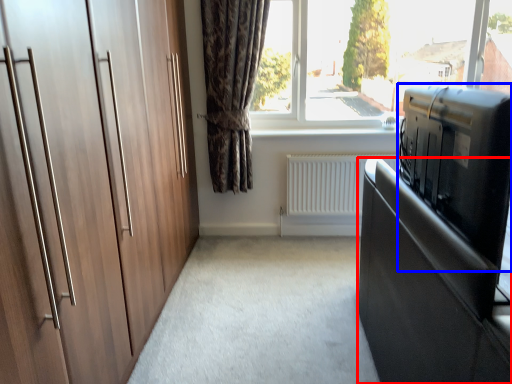
Question: Which point is closer to the camera, cabinetry (highlighted by a red box) or appliance (highlighted by a blue box)?

Choices:
 (A) cabinetry
 (B) appliance

Answer: (A)